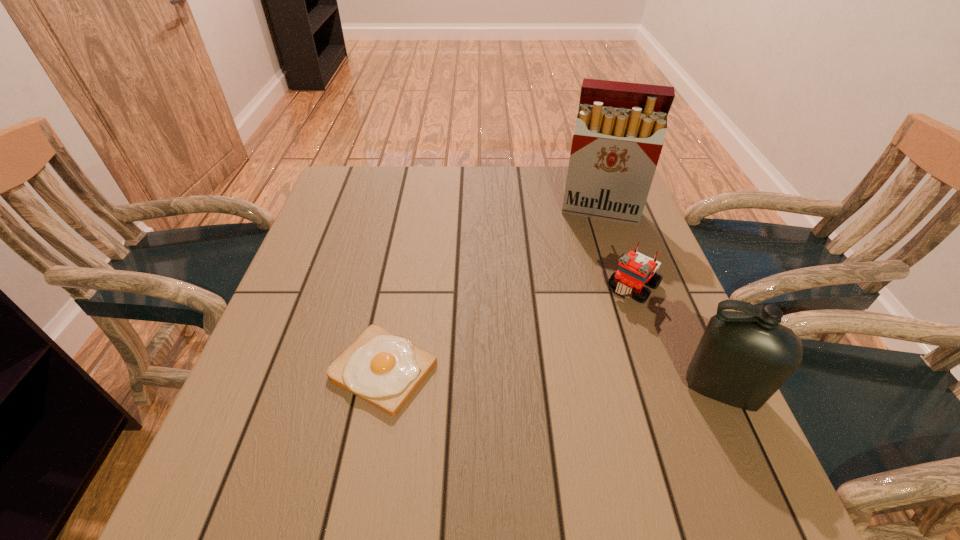
Locate an element on the screen. This screenshot has width=960, height=540. cigarette case situated at the right edge is located at coordinates (620, 127).

You are a GUI agent. You are given a task and a screenshot of the screen. Output one action in this format:
    pyautogui.click(x=<x>, y=<y>)
    Task: Click on the Lego located at the right edge
    
    Given the screenshot: What is the action you would take?
    pyautogui.click(x=635, y=269)

At what (x,y) coordinates should I click in order to perform the action: click on object that is at the near left corner. Please return your answer as a coordinate pair (x, y). This screenshot has width=960, height=540. Looking at the image, I should click on (383, 369).

The height and width of the screenshot is (540, 960). I want to click on object present at the far right corner, so click(620, 127).

Locate an element on the screen. Image resolution: width=960 pixels, height=540 pixels. object located in the near right corner section of the desktop is located at coordinates (743, 358).

This screenshot has width=960, height=540. In the image, there is a desktop. Identify the location of vacant space at the far edge. (428, 197).

At what (x,y) coordinates should I click in order to perform the action: click on vacant space at the left edge. Please return your answer as a coordinate pair (x, y). The image size is (960, 540). Looking at the image, I should click on (276, 354).

Locate an element on the screen. The image size is (960, 540). free space at the right edge of the desktop is located at coordinates (650, 305).

This screenshot has width=960, height=540. In the image, there is a desktop. Find the location of `vacant space at the far left corner`. vacant space at the far left corner is located at coordinates (358, 175).

In the image, there is a desktop. Identify the location of vacant space at the near right corner. (672, 404).